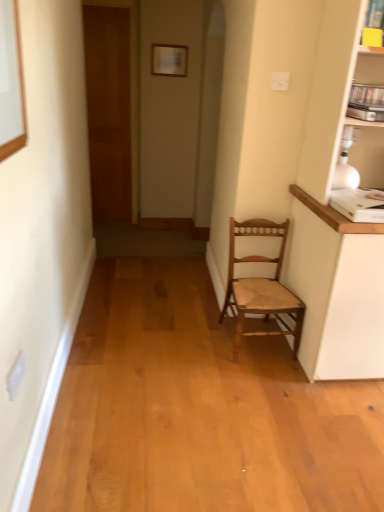
What are the coordinates of `free region under wooden chair at center (from a real-world perspective)` in the screenshot? It's located at (261, 342).